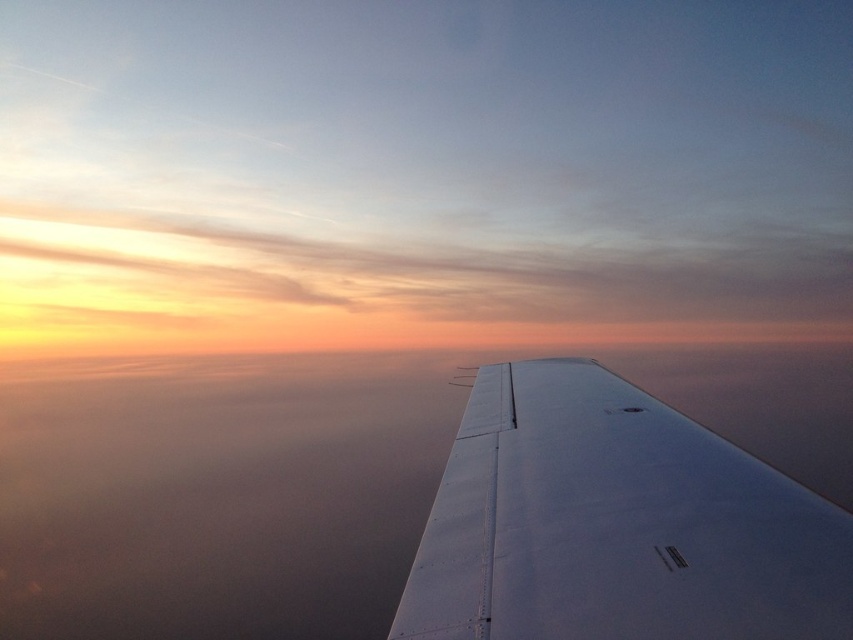
Looking at this image, you are a passenger sitting at the window seat and looking outside. You notice two objects in your view. Which object is closer to you between the white matte wing at center and the transparent glass airplane window at center?

The transparent glass airplane window at center is closer to you because it is positioned above the white matte wing at center.

You are sitting in an airplane seat and want to take a photo of the sunrise through the window. You have two options for windows to use for your shot. Which window would allow you to capture a wider view of the sunrise? Please choose between the transparent glass airplane window at lower right and the transparent glass airplane window at center.

The transparent glass airplane window at center would allow you to capture a wider view of the sunrise because it has a greater width compared to the transparent glass airplane window at lower right.